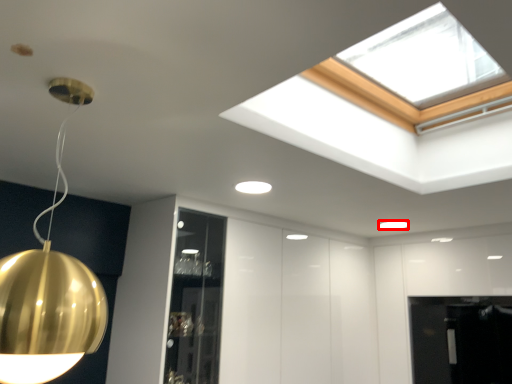
Question: From the image's perspective, what is the correct spatial positioning of lamp (annotated by the red box) in reference to lamp?

Choices:
 (A) above
 (B) below

Answer: (B)